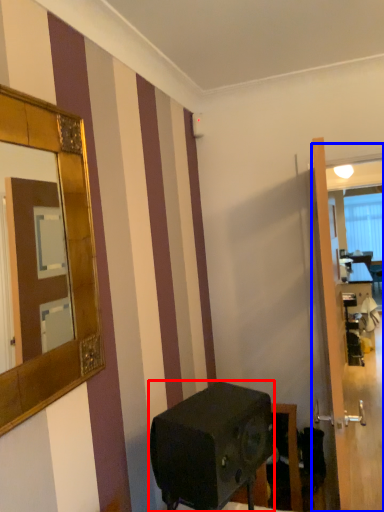
Question: Among these objects, which one is farthest to the camera, appliance (highlighted by a red box) or glass door (highlighted by a blue box)?

Choices:
 (A) appliance
 (B) glass door

Answer: (B)